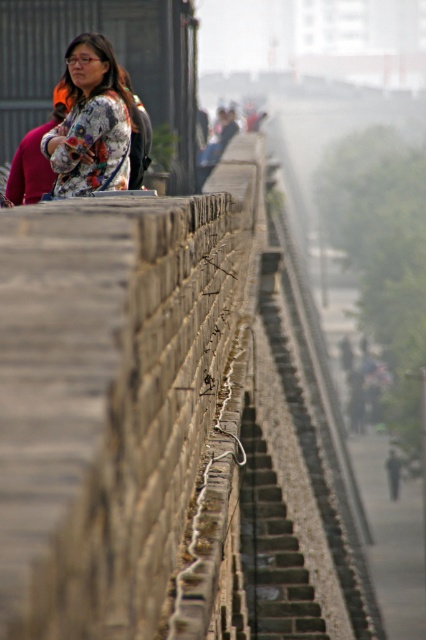
Question: Does brown stone ledge at upper center appear over floral-patterned fabric at upper center?

Choices:
 (A) no
 (B) yes

Answer: (A)

Question: Is brown stone ledge at upper center bigger than floral-patterned fabric at upper center?

Choices:
 (A) yes
 (B) no

Answer: (A)

Question: Among these points, which one is nearest to the camera?

Choices:
 (A) 299,605
 (B) 169,403

Answer: (B)

Question: Among these points, which one is farthest from the camera?

Choices:
 (A) (77, 36)
 (B) (244, 572)

Answer: (A)

Question: Which object is closer to the camera taking this photo?

Choices:
 (A) floral-patterned fabric at upper center
 (B) brown stone ledge at upper center
 (C) dark gray stone stairs at center

Answer: (B)

Question: Can you confirm if brown stone ledge at upper center is positioned to the left of dark gray stone stairs at center?

Choices:
 (A) no
 (B) yes

Answer: (B)